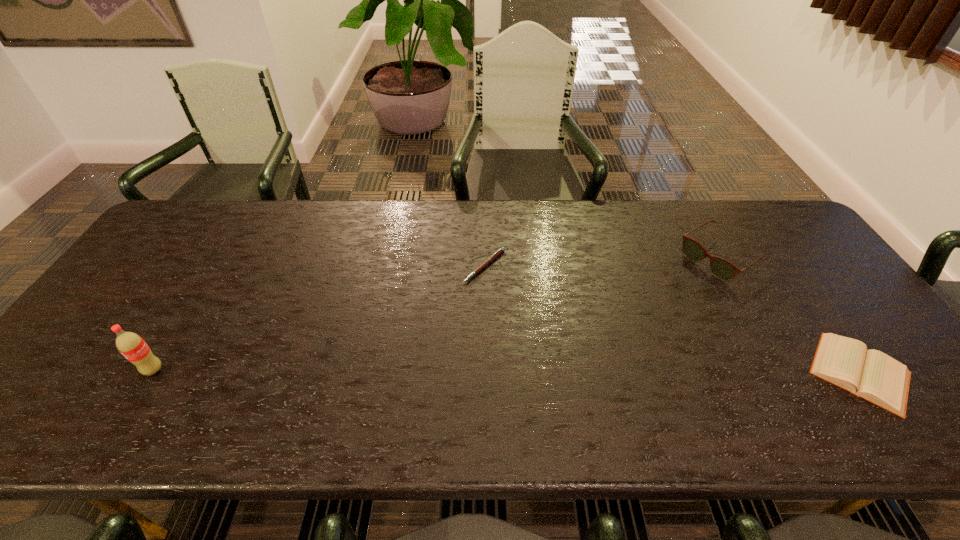
Identify the location of the tallest object. The width and height of the screenshot is (960, 540). (131, 345).

You are a GUI agent. You are given a task and a screenshot of the screen. Output one action in this format:
    pyautogui.click(x=<x>, y=<y>)
    Task: Click on the leftmost object
    
    Given the screenshot: What is the action you would take?
    pyautogui.click(x=131, y=345)

This screenshot has height=540, width=960. Identify the location of the second shortest object. (872, 375).

Where is `pen`? The image size is (960, 540). pen is located at coordinates coord(501,250).

Where is `the shortest object`? The image size is (960, 540). the shortest object is located at coordinates (501, 250).

Image resolution: width=960 pixels, height=540 pixels. I want to click on spectacles, so click(x=721, y=268).

The image size is (960, 540). I want to click on free space located on the back of the leftmost object, so click(227, 250).

What are the coordinates of `free space located on the back of the second shortest object` in the screenshot? It's located at (772, 248).

Where is `vacant area located at the nib of the shortest object`? Image resolution: width=960 pixels, height=540 pixels. vacant area located at the nib of the shortest object is located at coordinates (542, 390).

Where is `free space located 0.230m at the nib of the shortest object`? The image size is (960, 540). free space located 0.230m at the nib of the shortest object is located at coordinates (523, 348).